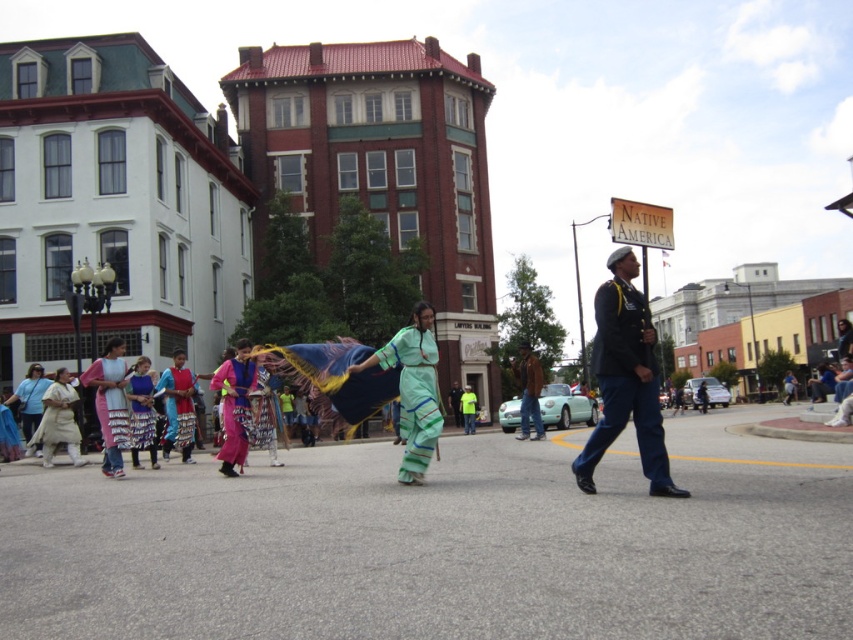
Is green fabric dress at center to the left of matte pink fabric dress at left from the viewer's perspective?

Incorrect, green fabric dress at center is not on the left side of matte pink fabric dress at left.

Is green fabric dress at center smaller than matte pink fabric dress at left?

Yes, green fabric dress at center is smaller than matte pink fabric dress at left.

The image size is (853, 640). Describe the element at coordinates (413, 388) in the screenshot. I see `green fabric dress at center` at that location.

Where is `green fabric dress at center`? Image resolution: width=853 pixels, height=640 pixels. green fabric dress at center is located at coordinates (413, 388).

Between blue satin dress at center and matte green dress at lower left, which one has more height?

blue satin dress at center

Does blue satin dress at center have a smaller size compared to matte green dress at lower left?

No.

What are the coordinates of `blue satin dress at center` in the screenshot? It's located at pyautogui.click(x=178, y=406).

Who is positioned more to the right, green fabric dress at center or matte blue dress at center?

From the viewer's perspective, green fabric dress at center appears more on the right side.

Is green fabric dress at center smaller than matte blue dress at center?

Correct, green fabric dress at center occupies less space than matte blue dress at center.

At what (x,y) coordinates should I click in order to perform the action: click on green fabric dress at center. Please return your answer as a coordinate pair (x, y). Looking at the image, I should click on (413, 388).